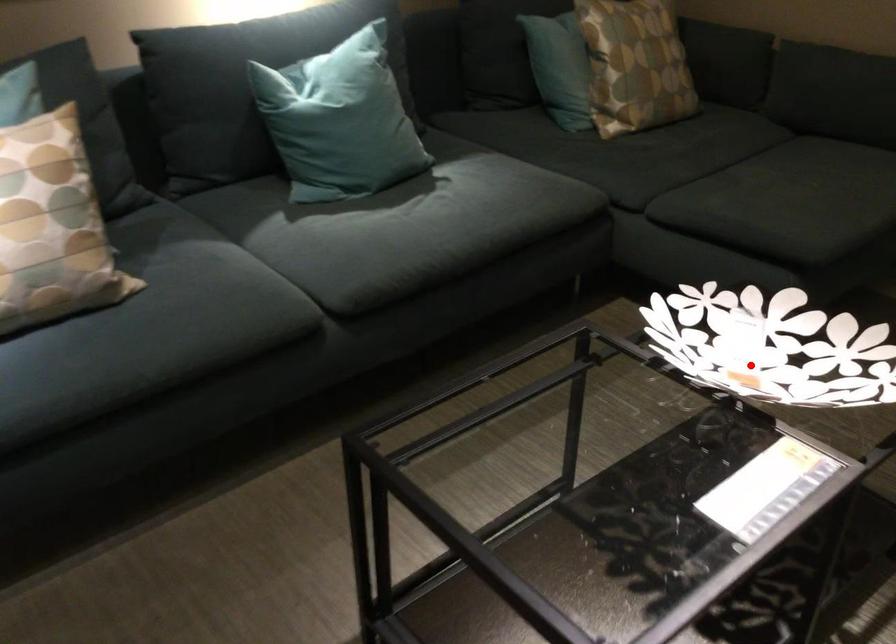
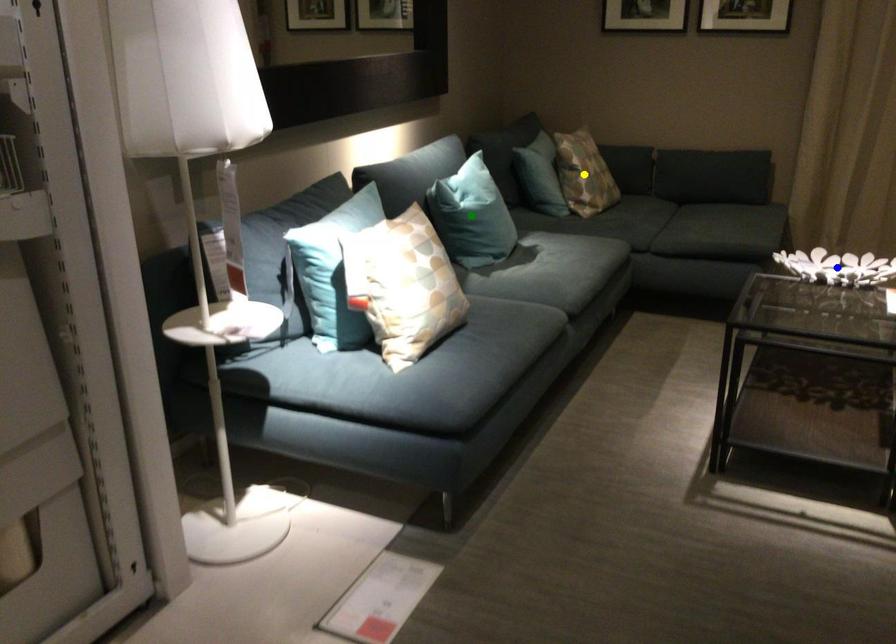
Question: I am providing you with two images of the same scene from different viewpoints. A red point is marked on the first image. You are given multiple points on the second image. In image 2, which mark is for the same physical point as the one in image 1?

Choices:
 (A) green point
 (B) yellow point
 (C) blue point

Answer: (C)